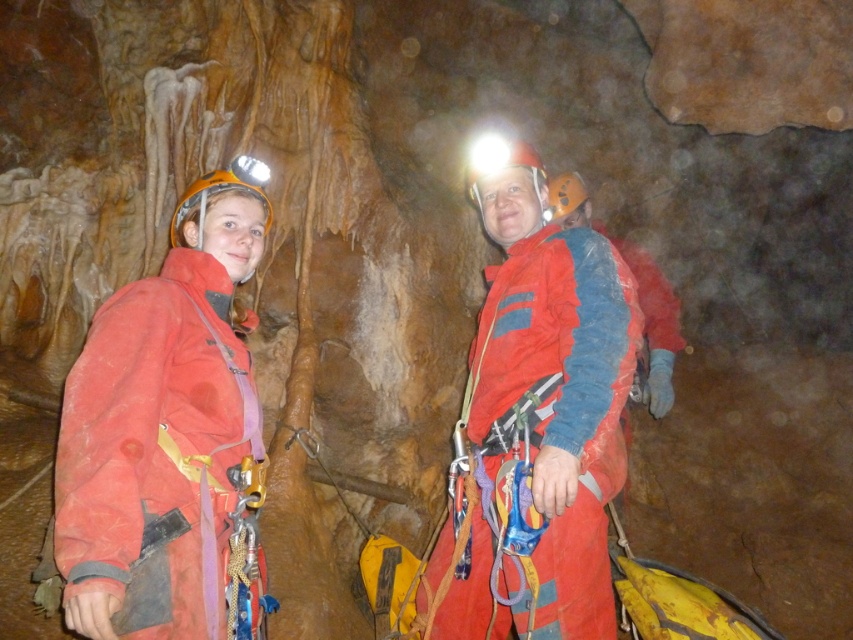
Who is more forward, (74, 596) or (508, 154)?

Positioned in front is point (74, 596).

The height and width of the screenshot is (640, 853). I want to click on matte orange helmet at left, so click(x=165, y=429).